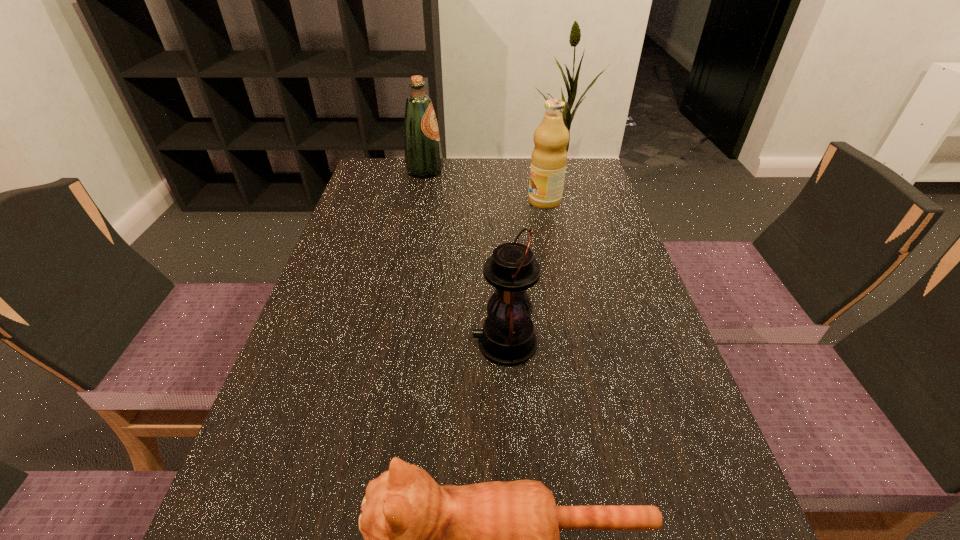
I want to click on free space between the left olive oil and the lantern, so click(465, 257).

The width and height of the screenshot is (960, 540). What are the coordinates of `vacant region between the farthest object and the right olive oil` in the screenshot? It's located at (485, 186).

Locate an element on the screen. The width and height of the screenshot is (960, 540). vacant space that's between the third farthest object and the left olive oil is located at coordinates (465, 257).

Locate an element on the screen. free space between the right olive oil and the farther olive oil is located at coordinates (485, 186).

Identify the location of the closest object to the second farthest object. The width and height of the screenshot is (960, 540). (423, 156).

Where is `object that is the second nearest to the nearest object`? The height and width of the screenshot is (540, 960). object that is the second nearest to the nearest object is located at coordinates (549, 157).